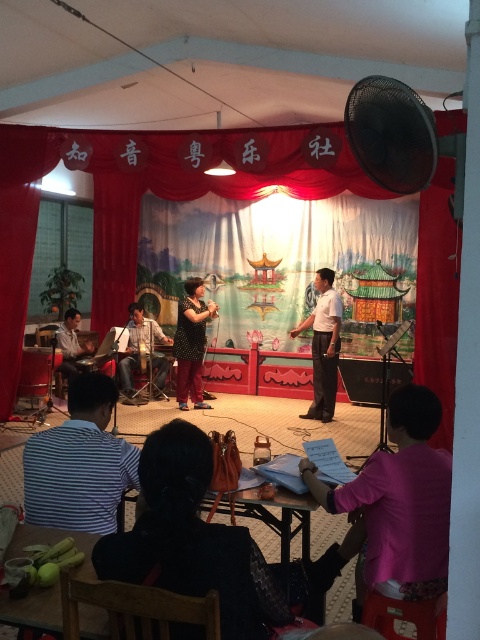
Is striped fabric shirt at lower left below white smooth shirt at center?

Correct, striped fabric shirt at lower left is located below white smooth shirt at center.

Which is in front, point (46, 474) or point (338, 337)?

Point (46, 474) is more forward.

Where is `striped fabric shirt at lower left`? striped fabric shirt at lower left is located at coordinates (80, 464).

Find the location of a particular element. This screenshot has height=640, width=480. striped fabric shirt at lower left is located at coordinates (80, 464).

Is pink fabric at lower right wider than light brown wooden drum at center?

Incorrect, pink fabric at lower right's width does not surpass light brown wooden drum at center's.

Based on the photo, who is lower down, pink fabric at lower right or light brown wooden drum at center?

pink fabric at lower right is lower down.

This screenshot has width=480, height=640. What are the coordinates of `pink fabric at lower right` in the screenshot? It's located at (396, 504).

Which is below, white smooth shirt at center or patterned fabric dress at center?

patterned fabric dress at center is below.

What do you see at coordinates (324, 346) in the screenshot?
I see `white smooth shirt at center` at bounding box center [324, 346].

You are a GUI agent. You are given a task and a screenshot of the screen. Output one action in this format:
    pyautogui.click(x=<x>, y=<y>)
    Task: Click on the white smooth shirt at center
    The width and height of the screenshot is (480, 640).
    Given the screenshot: What is the action you would take?
    pyautogui.click(x=324, y=346)